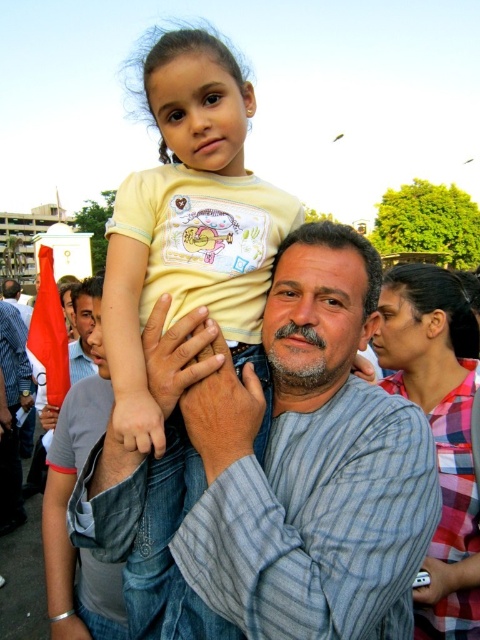
You are a photographer trying to capture a closeup of the matte yellow shirt at upper center and the gray striped shirt at center. Given that your camera has a maximum focus range of 25 meters, will you be able to focus on both shirts simultaneously?

The matte yellow shirt at upper center is 30.46 meters away from the gray striped shirt at center. Since the camera can only focus up to 25 meters, it cannot focus on both shirts at the same time because the distance between them exceeds the maximum range.

You are standing at the point with coordinates point (12,280) and want to move towards the point with coordinates point (144,388). Based on the scene description, will you be moving towards the man holding the girl or away from him?

Point (144,388) is in front of point (12,280). Since you are moving from point (12,280) towards point (144,388), you are moving towards the man holding the girl because the point you are moving to is closer to the man and girl than the starting point.